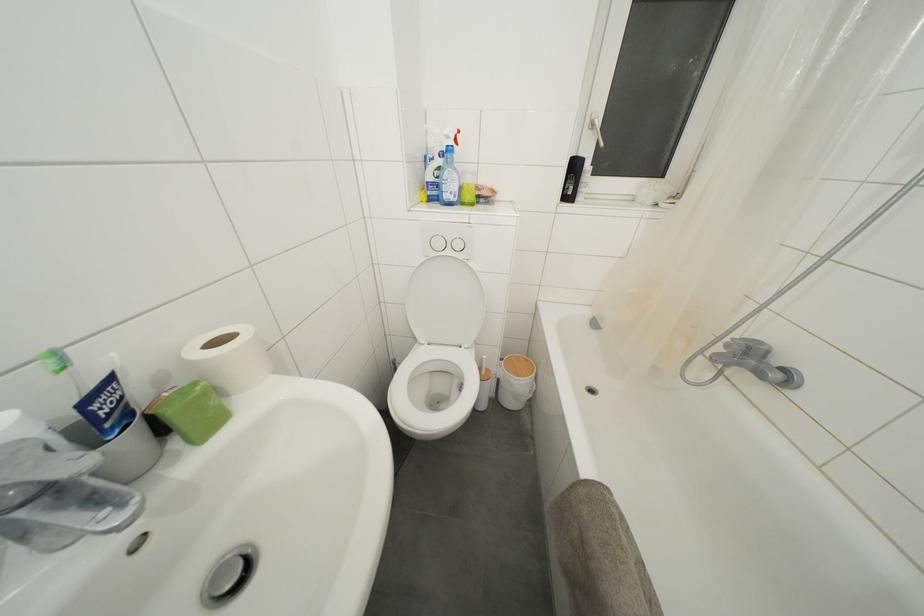
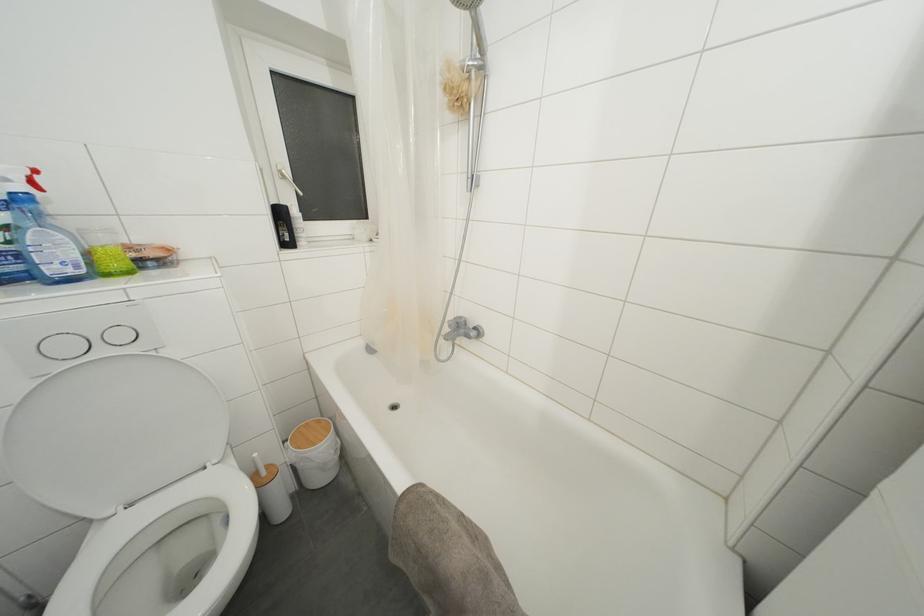
In the second image, find the point that corresponds to (x=489, y=362) in the first image.

(260, 459)